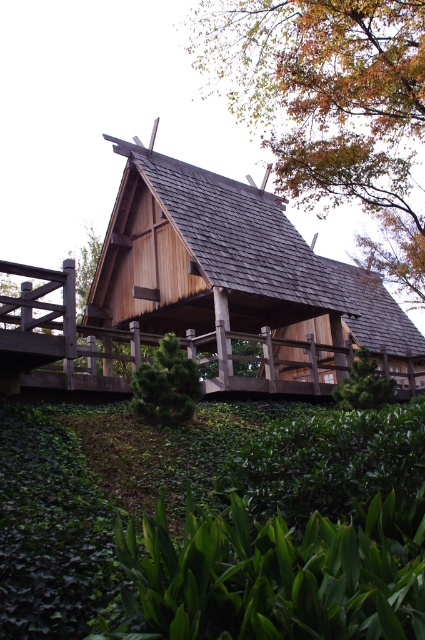
Question: Which point is closer to the camera?

Choices:
 (A) wooden cabin at center
 (B) brown wooden roof at upper center

Answer: (A)

Question: Among these points, which one is farthest from the camera?

Choices:
 (A) (138, 195)
 (B) (198, 42)

Answer: (B)

Question: Is the position of wooden cabin at center less distant than that of brown wooden roof at upper center?

Choices:
 (A) no
 (B) yes

Answer: (B)

Question: In this image, where is wooden cabin at center located relative to brown wooden roof at upper center?

Choices:
 (A) right
 (B) left

Answer: (B)

Question: Which point is farther from the camera taking this photo?

Choices:
 (A) (370, 148)
 (B) (348, 307)

Answer: (B)

Question: From the image, what is the correct spatial relationship of wooden cabin at center in relation to brown wooden roof at upper center?

Choices:
 (A) left
 (B) right

Answer: (A)